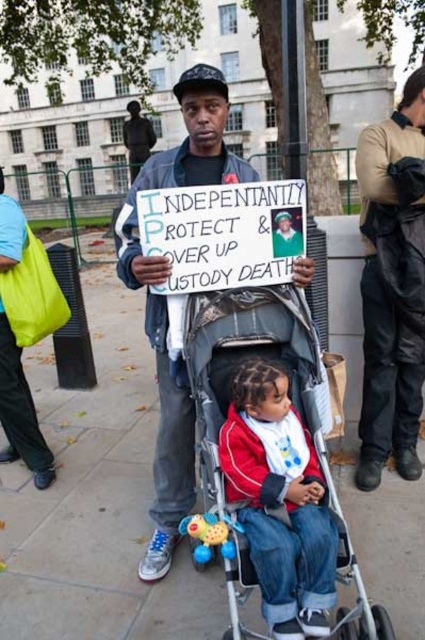
Who is positioned more to the left, gray concrete pavement at center or camouflage fabric stroller at center?

Positioned to the left is gray concrete pavement at center.

Is gray concrete pavement at center below camouflage fabric stroller at center?

Correct, gray concrete pavement at center is located below camouflage fabric stroller at center.

Which is behind, point (133, 554) or point (277, 340)?

The point (133, 554) is behind.

Where is `gray concrete pavement at center`? gray concrete pavement at center is located at coordinates (96, 500).

Can you confirm if camouflage fabric stroller at center is shorter than matte black jacket at center?

Yes, camouflage fabric stroller at center is shorter than matte black jacket at center.

Who is more forward, (248, 564) or (147, 579)?

Point (248, 564) is more forward.

You are a GUI agent. You are given a task and a screenshot of the screen. Output one action in this format:
    pyautogui.click(x=<x>, y=<y>)
    Task: Click on the camouflage fabric stroller at center
    
    Given the screenshot: What is the action you would take?
    pyautogui.click(x=294, y=406)

Where is `camouflage fabric stroller at center`? The width and height of the screenshot is (425, 640). camouflage fabric stroller at center is located at coordinates (294, 406).

Based on the photo, is camouflage fabric stroller at center thinner than dark brown leather jacket at center?

No.

Measure the distance from camouflage fabric stroller at center to dark brown leather jacket at center.

The distance of camouflage fabric stroller at center from dark brown leather jacket at center is 4.36 feet.

The image size is (425, 640). Identify the location of camouflage fabric stroller at center. (294, 406).